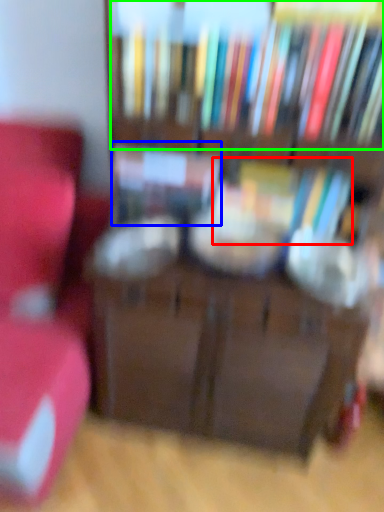
Question: Estimate the real-world distances between objects in this image. Which object is farther from book (highlighted by a red box), book (highlighted by a blue box) or book (highlighted by a green box)?

Choices:
 (A) book
 (B) book

Answer: (B)